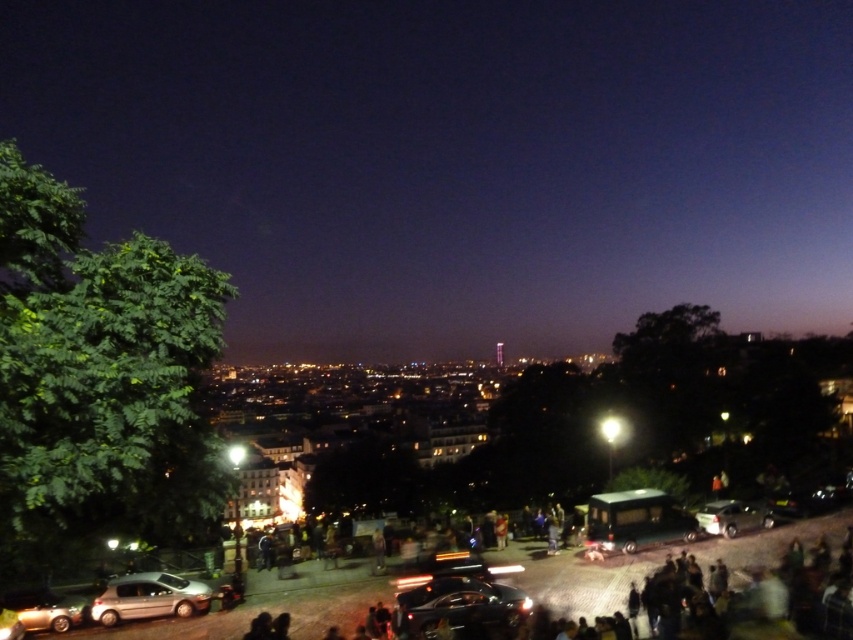
Question: Among these objects, which one is nearest to the camera?

Choices:
 (A) glossy black car at lower center
 (B) metallic silver car at lower right
 (C) silver metallic hatchback at lower left

Answer: (A)

Question: Is silver metallic hatchback at lower left wider than metallic silver car at lower right?

Choices:
 (A) no
 (B) yes

Answer: (B)

Question: Among these objects, which one is nearest to the camera?

Choices:
 (A) glossy black car at lower center
 (B) silver metallic hatchback at lower left
 (C) metallic silver car at lower right

Answer: (A)

Question: Does glossy black car at lower center appear over metallic silver car at lower right?

Choices:
 (A) no
 (B) yes

Answer: (A)

Question: Does glossy black car at lower center appear on the left side of metallic silver car at lower right?

Choices:
 (A) yes
 (B) no

Answer: (A)

Question: Considering the real-world distances, which object is closest to the metallic silver car at lower right?

Choices:
 (A) glossy black car at lower center
 (B) silver metallic hatchback at lower left

Answer: (A)